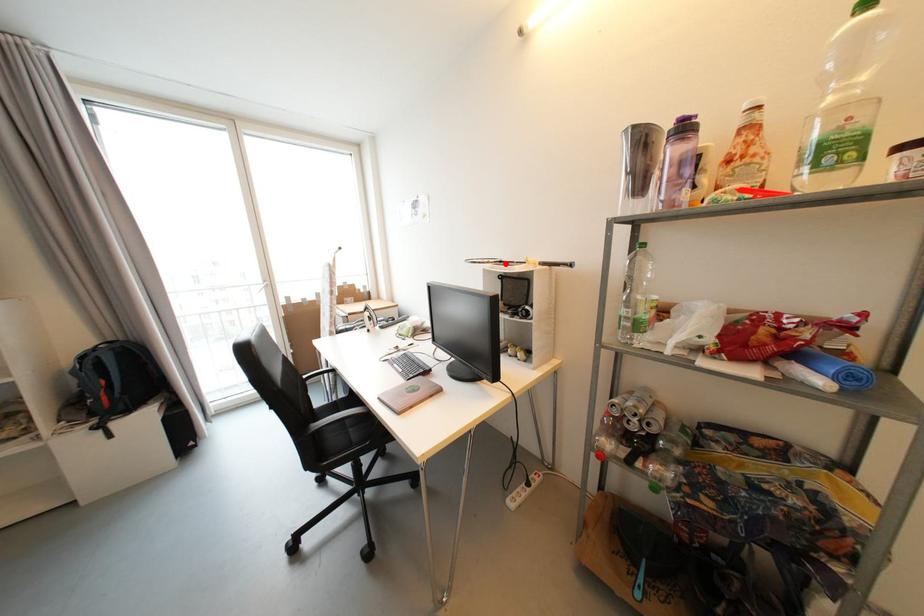
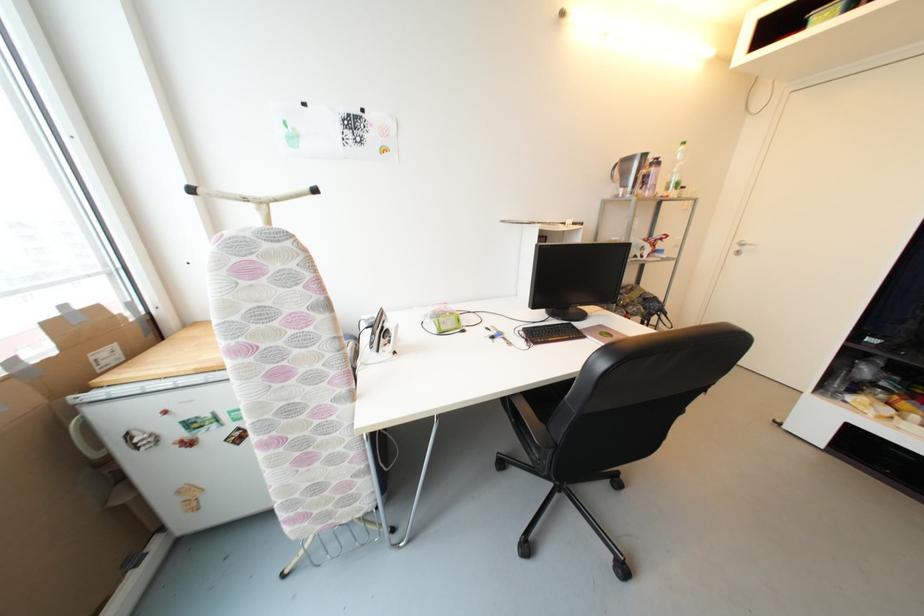
Locate, in the second image, the point that corresponds to the highlighted location in the first image.

(540, 225)